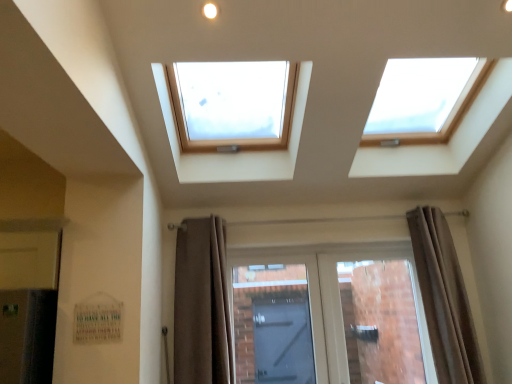
Question: Can you confirm if brown fabric curtain at right, the first curtain when ordered from right to left, is positioned to the left of brown fabric curtain at lower center, acting as the 2th curtain starting from the right?

Choices:
 (A) yes
 (B) no

Answer: (B)

Question: Is brown fabric curtain at right, the first curtain when ordered from right to left, positioned beyond the bounds of brown fabric curtain at lower center, the 1th curtain from the left?

Choices:
 (A) yes
 (B) no

Answer: (A)

Question: Could you tell me if brown fabric curtain at right, the second curtain from the left, is facing brown fabric curtain at lower center, the 1th curtain from the left?

Choices:
 (A) no
 (B) yes

Answer: (A)

Question: Is brown fabric curtain at right, the second curtain from the left, smaller than brown fabric curtain at lower center, acting as the 2th curtain starting from the right?

Choices:
 (A) yes
 (B) no

Answer: (B)

Question: Is brown fabric curtain at right, the second curtain from the left, wider than brown fabric curtain at lower center, the 1th curtain from the left?

Choices:
 (A) no
 (B) yes

Answer: (B)

Question: Is point (428, 289) closer or farther from the camera than point (403, 360)?

Choices:
 (A) farther
 (B) closer

Answer: (B)

Question: From their relative heights in the image, would you say brown fabric curtain at right, the second curtain from the left, is taller or shorter than matte glass door at center?

Choices:
 (A) short
 (B) tall

Answer: (B)

Question: In terms of width, does brown fabric curtain at right, the first curtain when ordered from right to left, look wider or thinner when compared to matte glass door at center?

Choices:
 (A) thin
 (B) wide

Answer: (B)

Question: Considering the relative positions of brown fabric curtain at right, the first curtain when ordered from right to left, and matte glass door at center in the image provided, is brown fabric curtain at right, the first curtain when ordered from right to left, to the left or to the right of matte glass door at center?

Choices:
 (A) left
 (B) right

Answer: (B)

Question: From their relative heights in the image, would you say matte glass door at center is taller or shorter than brown fabric curtain at lower center, the 1th curtain from the left?

Choices:
 (A) short
 (B) tall

Answer: (A)

Question: Relative to brown fabric curtain at lower center, the 1th curtain from the left, is matte glass door at center in front or behind?

Choices:
 (A) behind
 (B) front

Answer: (A)

Question: Is matte glass door at center situated inside brown fabric curtain at lower center, acting as the 2th curtain starting from the right, or outside?

Choices:
 (A) inside
 (B) outside

Answer: (B)

Question: Looking at the image, does matte glass door at center seem bigger or smaller compared to brown fabric curtain at lower center, acting as the 2th curtain starting from the right?

Choices:
 (A) big
 (B) small

Answer: (A)

Question: Considering the positions of brown fabric curtain at right, the first curtain when ordered from right to left, and brown fabric curtain at lower center, the 1th curtain from the left, in the image, is brown fabric curtain at right, the first curtain when ordered from right to left, taller or shorter than brown fabric curtain at lower center, the 1th curtain from the left,?

Choices:
 (A) tall
 (B) short

Answer: (A)

Question: In the image, is brown fabric curtain at right, the first curtain when ordered from right to left, positioned in front of or behind brown fabric curtain at lower center, the 1th curtain from the left?

Choices:
 (A) front
 (B) behind

Answer: (B)